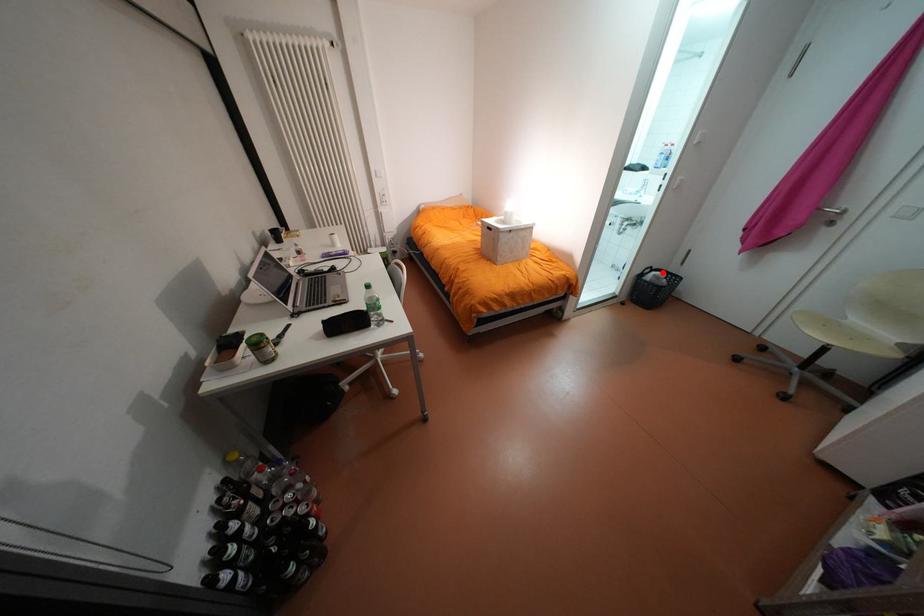
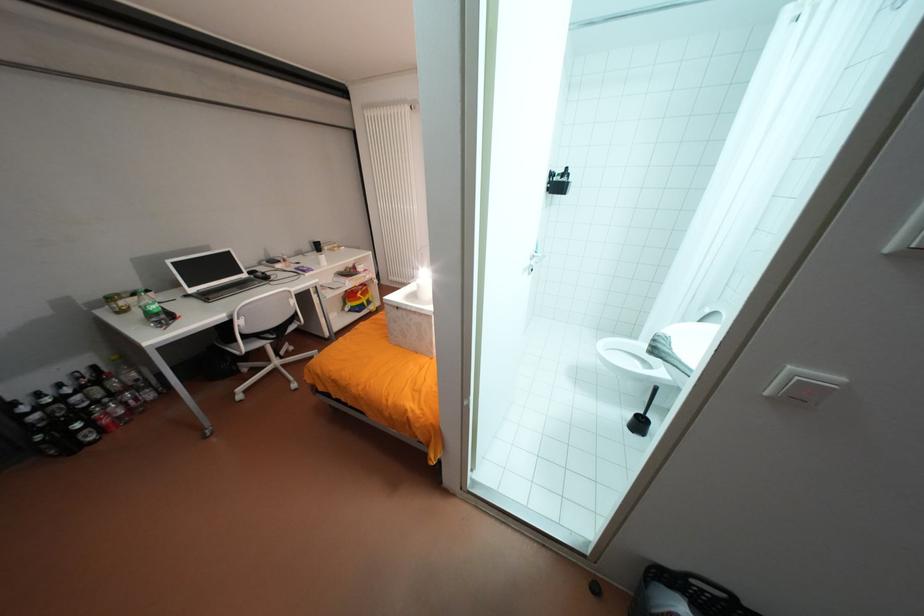
Question: I am providing you with two images of the same scene from different viewpoints. Given a red point in image1, look at the same physical point in image2. Is it:

Choices:
 (A) Closer to the viewpoint
 (B) Farther from the viewpoint

Answer: (A)